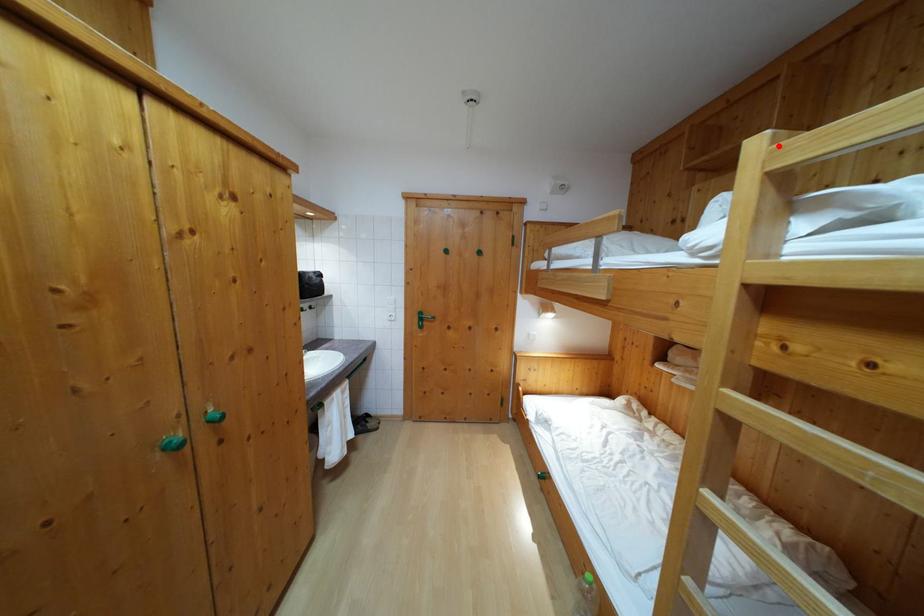
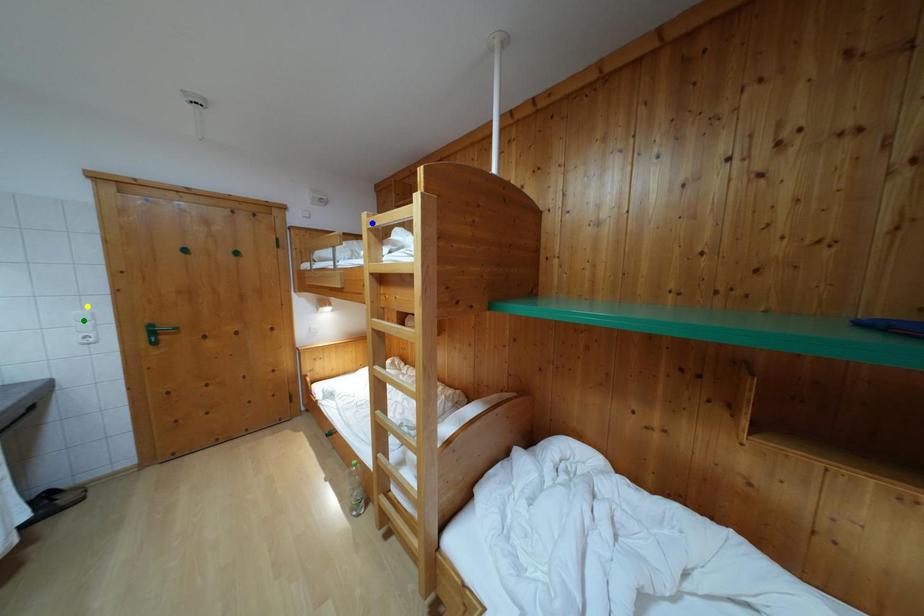
Question: I am providing you with two images of the same scene from different viewpoints. A red point is marked on the first image. You are given multiple points on the second image. Which point in image 2 represents the same 3d spot as the red point in image 1?

Choices:
 (A) yellow point
 (B) green point
 (C) blue point

Answer: (C)